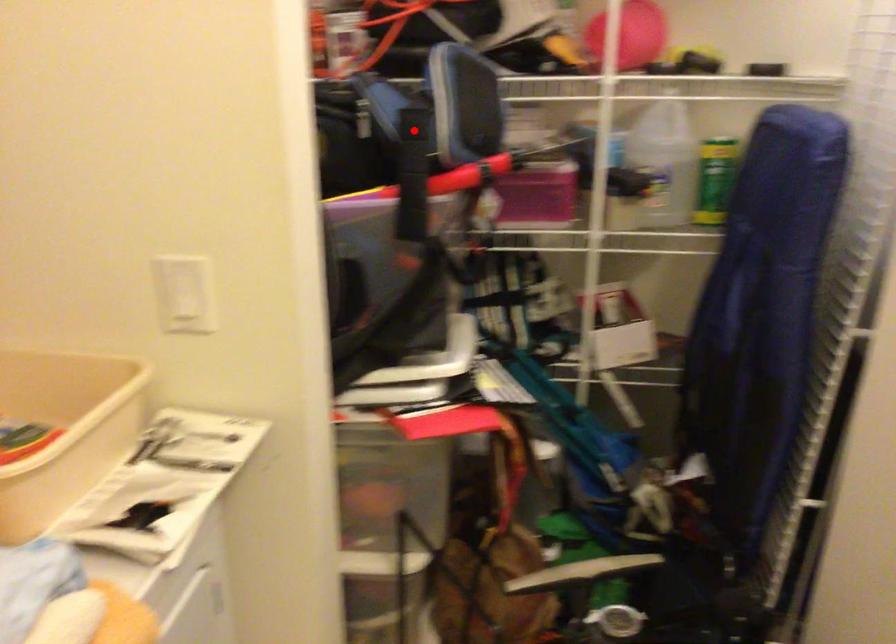
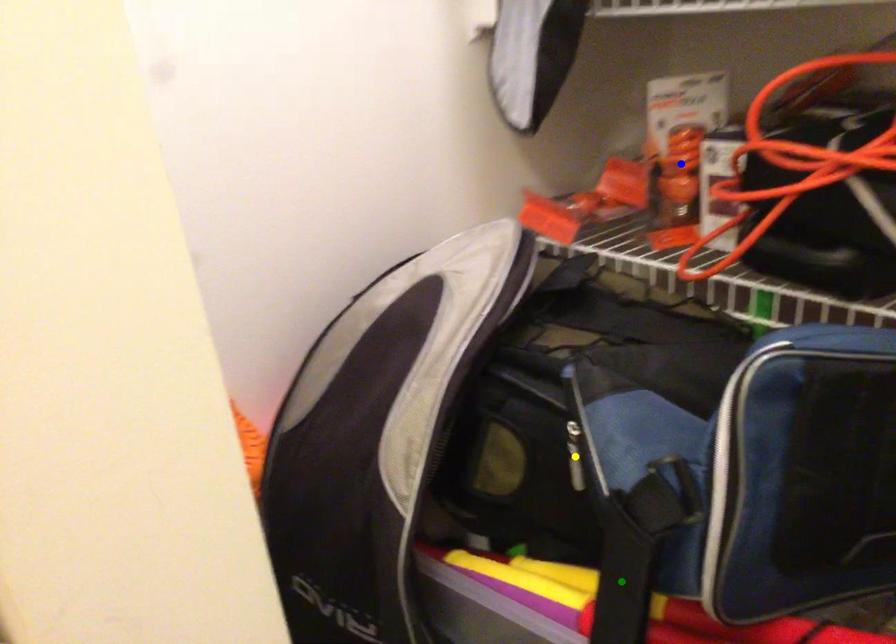
Question: I am providing you with two images of the same scene from different viewpoints. A red point is marked on the first image. You are given multiple points on the second image. Which point in image 2 is actually the same real-world point as the red point in image 1?

Choices:
 (A) blue point
 (B) yellow point
 (C) green point

Answer: (C)